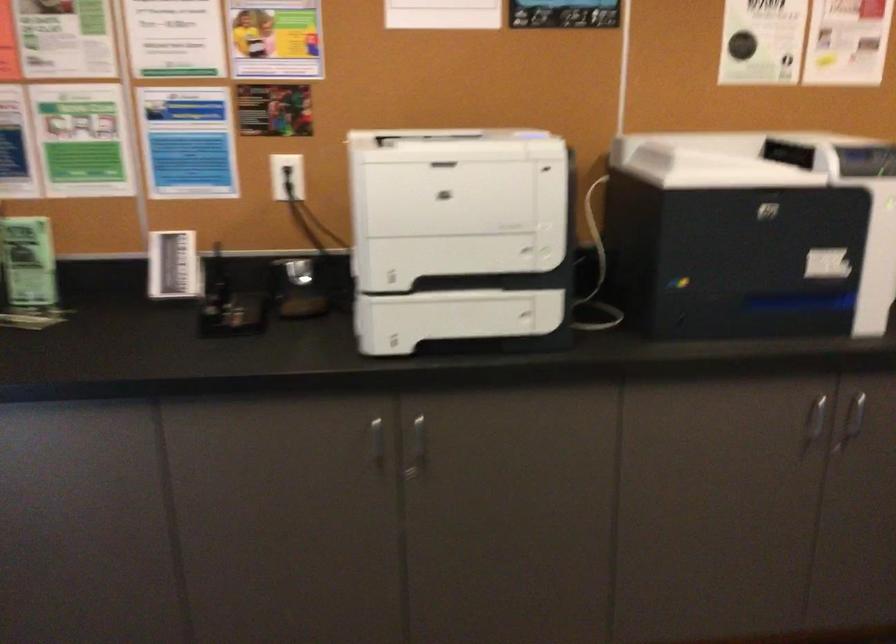
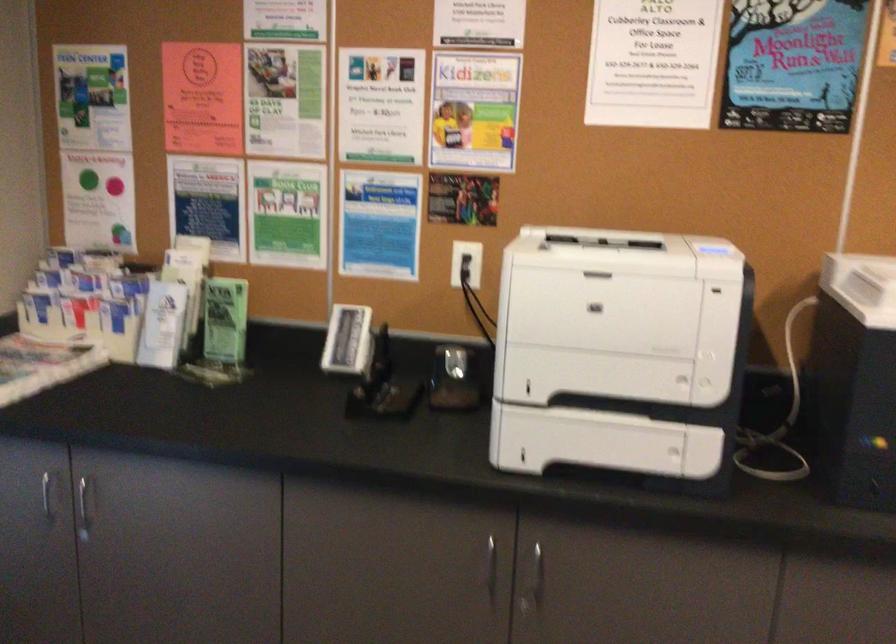
Question: The camera is either moving clockwise (left) or counter-clockwise (right) around the object. The first image is from the beginning of the video and the second image is from the end. Is the camera moving left or right when shooting the video?

Choices:
 (A) Left
 (B) Right

Answer: (B)